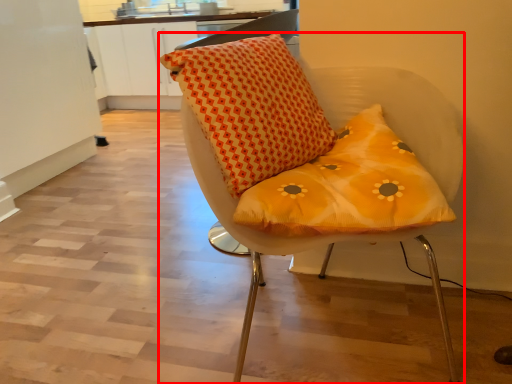
Question: In this image, where is chair (annotated by the red box) located relative to pillow?

Choices:
 (A) left
 (B) right

Answer: (B)